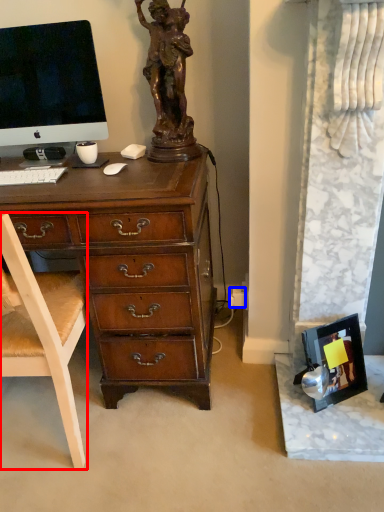
Question: Among these objects, which one is farthest to the camera, chair (highlighted by a red box) or power outlet (highlighted by a blue box)?

Choices:
 (A) chair
 (B) power outlet

Answer: (B)